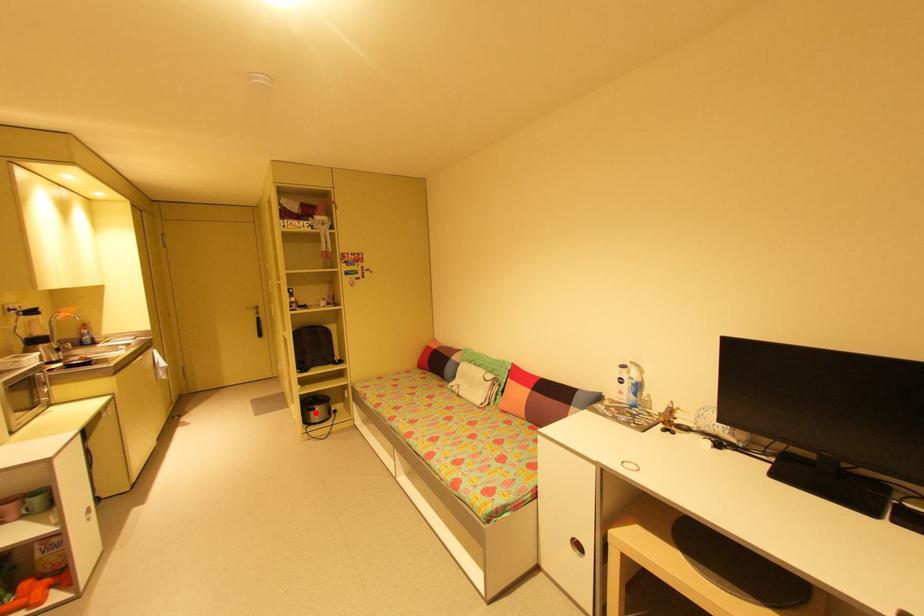
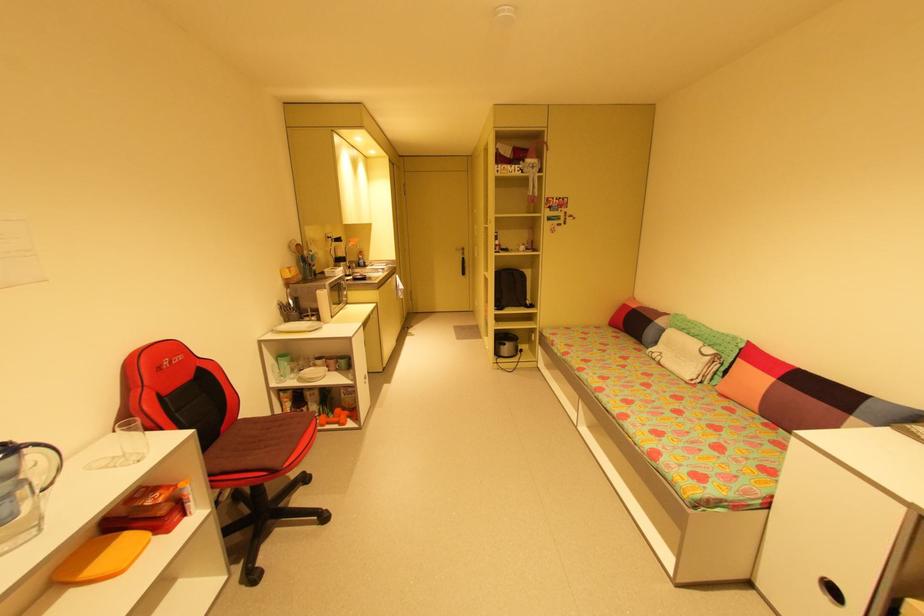
Question: I am providing you with two images of the same scene from different viewpoints. A red point is shown in image1. For the corresponding object point in image2, is it positioned nearer or farther from the camera?

Choices:
 (A) Nearer
 (B) Farther

Answer: (B)